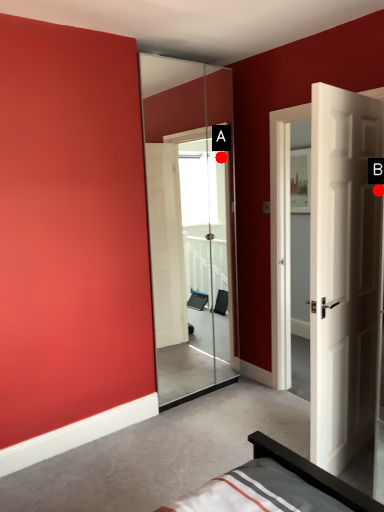
Question: Two points are circled on the image, labeled by A and B beside each circle. Among these points, which one is farthest from the camera?

Choices:
 (A) A is further
 (B) B is further

Answer: (A)